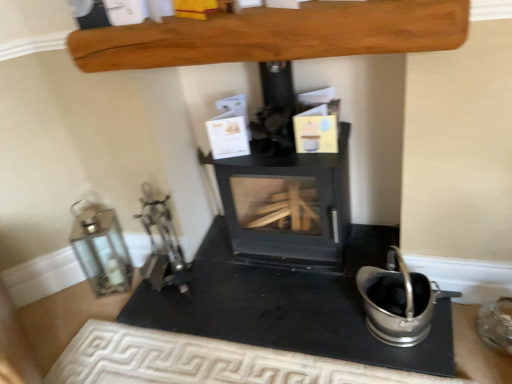
Question: Is point (120, 266) positioned closer to the camera than point (508, 317)?

Choices:
 (A) farther
 (B) closer

Answer: (A)

Question: Considering the positions of silver metallic lantern at left, the 3th appliance positioned from the right, and transparent glass jar at lower right, the 1th appliance in the right-to-left sequence, in the image, is silver metallic lantern at left, the 3th appliance positioned from the right, wider or thinner than transparent glass jar at lower right, the 1th appliance in the right-to-left sequence,?

Choices:
 (A) thin
 (B) wide

Answer: (B)

Question: Based on their relative distances, which object is farther from the smooth wooden beam at upper center?

Choices:
 (A) black matte wood burning stove at center
 (B) transparent glass jar at lower right, positioned as the third appliance in left-to-right order
 (C) silver metallic lantern at left, the 3th appliance positioned from the right
 (D) satin silver bucket at lower right, acting as the 2th appliance starting from the left

Answer: (B)

Question: Estimate the real-world distances between objects in this image. Which object is farther from the satin silver bucket at lower right, acting as the 2th appliance starting from the left?

Choices:
 (A) transparent glass jar at lower right, the 1th appliance in the right-to-left sequence
 (B) smooth wooden beam at upper center
 (C) black matte wood burning stove at center
 (D) silver metallic lantern at left, acting as the 1th appliance starting from the left

Answer: (D)